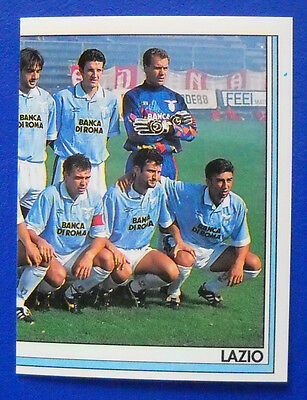
Locate an element on the screen. small portrait of soccer players is located at coordinates (135, 163).